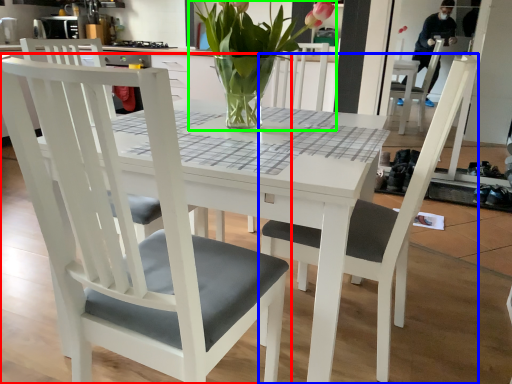
Question: Which object is the farthest from chair (highlighted by a red box)? Choose among these: chair (highlighted by a blue box) or houseplant (highlighted by a green box).

Choices:
 (A) chair
 (B) houseplant

Answer: (B)